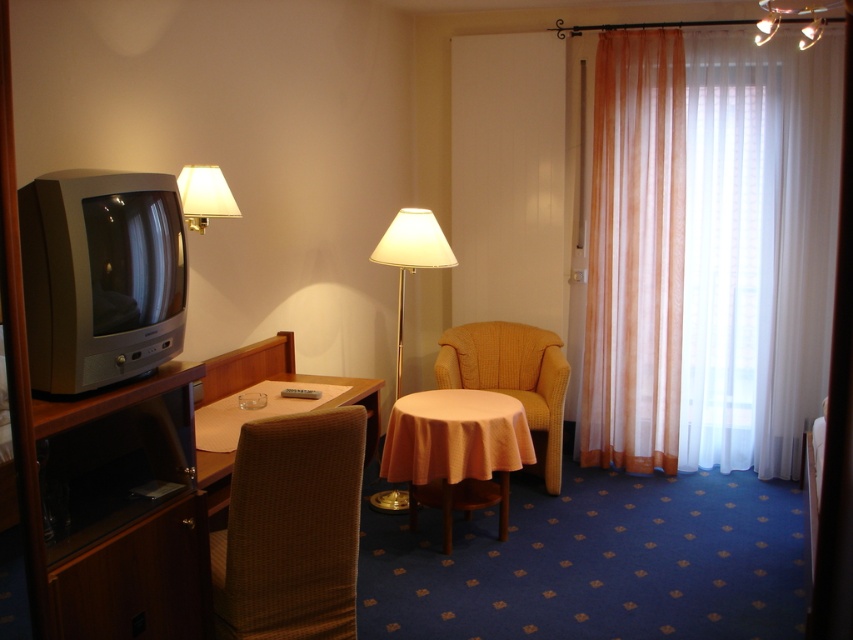
You are standing in the room and want to see what is behind the translucent white curtain at right. Can you see the white fabric lampshade at upper left through the curtain?

The white fabric lampshade at upper left is behind the translucent white curtain at right, so it cannot be seen through the curtain.

You are standing in the room and want to know which object takes up more horizontal space. Which one is wider, the translucent white curtain at right or the yellow knitted armchair at center?

The translucent white curtain at right is wider than the yellow knitted armchair at center according to the description.